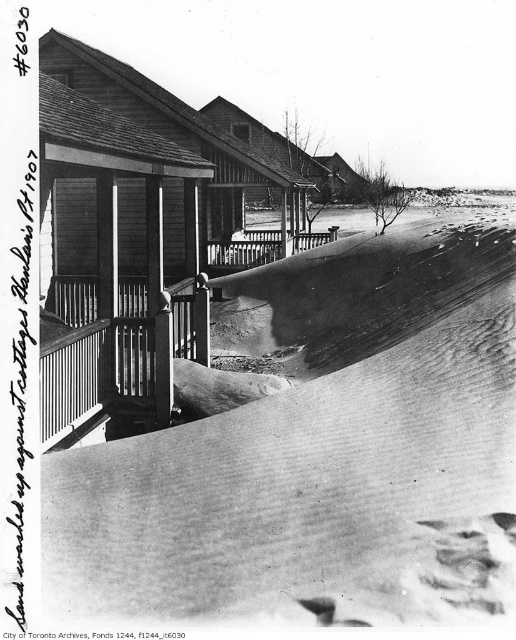
Who is positioned more to the right, white powdery snow at center or wooden porch at center?

white powdery snow at center is more to the right.

Which is more to the left, white powdery snow at center or wooden porch at center?

Positioned to the left is wooden porch at center.

Based on the photo, who is more distant from viewer, (x=346, y=595) or (x=179, y=104)?

Point (x=179, y=104)

Identify the location of white powdery snow at center. The width and height of the screenshot is (516, 640). (317, 451).

Describe the element at coordinates (180, 136) in the screenshot. I see `wooden porch at center` at that location.

Does point (218, 179) lie behind point (346, 202)?

No.

This screenshot has width=516, height=640. What are the coordinates of `wooden porch at center` in the screenshot? It's located at 180,136.

Which of these two, white powdery snow at center or wooden railing at center, stands shorter?

Standing shorter between the two is wooden railing at center.

Which is above, white powdery snow at center or wooden railing at center?

white powdery snow at center is above.

Is point (186, 531) farther from viewer compared to point (58, 408)?

No, it is not.

Where is `white powdery snow at center`? Image resolution: width=516 pixels, height=640 pixels. white powdery snow at center is located at coordinates (317, 451).